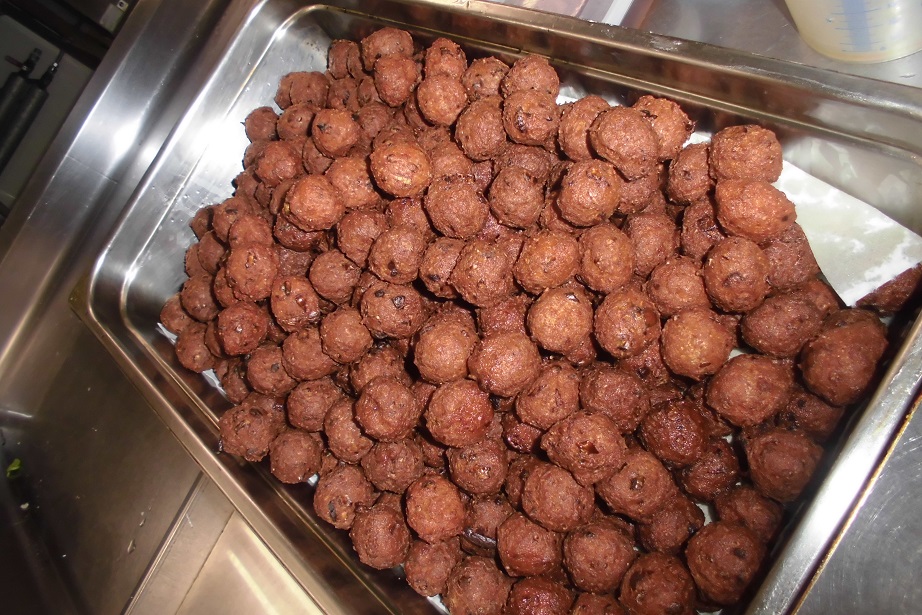
The height and width of the screenshot is (615, 922). I want to click on baking pan, so click(220, 129).